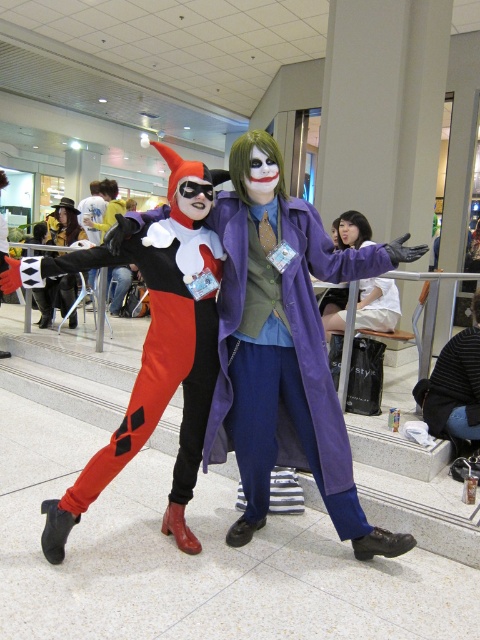
You are organizing a cosplay event and need to ensure all costumes fit through a 1.5 meter wide doorway. Given the sizes of the matte black and red spandex pants at center and the denim jacket at lower right, will they both fit through the doorway without needing to be adjusted?

The matte black and red spandex pants at center is bigger than the denim jacket at lower right. Since the largest item is the spandex pants, and the doorway is 1.5 meters wide, the spandex pants would need to be checked if their width is under 1.5 meters. However, without specific width measurements, it is impossible to confirm if they will fit through the doorway.

You are a photographer at the convention center. You want to take a photo of the two points in the image. The first point is at position point (241, 300) and the second point is at position point (432, 420). To ensure both points are in focus, you need to know which point is closer to the camera. Which point is closer?

Point (241, 300) is in front of point (432, 420), so it is closer to the camera.

From the picture: You are a photographer at a cosplay event. You need to capture a photo that includes both the matte black and red spandex pants at center and the denim jacket at lower right. Based on their positions, which object should be closer to the camera to ensure both are in focus?

The matte black and red spandex pants at center is in front of the denim jacket at lower right, so to ensure both are in focus, the photographer should position the camera closer to the matte black and red spandex pants at center since it is the closer object.